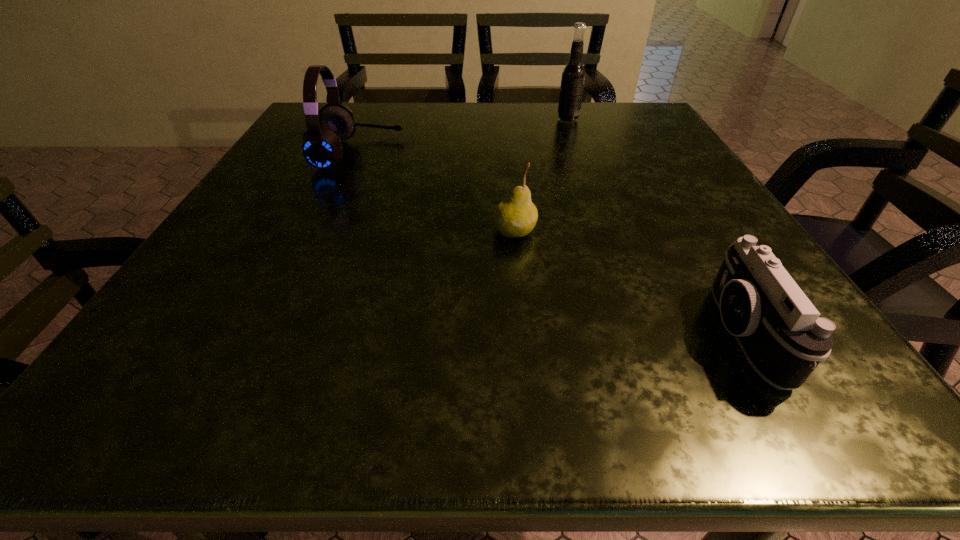
What are the coordinates of `vacant space located 0.150m on the label of the second object from right to left` in the screenshot? It's located at (494, 120).

Where is `free space located 0.120m on the ear cushions of the third shortest object`? free space located 0.120m on the ear cushions of the third shortest object is located at coordinates (456, 153).

The width and height of the screenshot is (960, 540). What are the coordinates of `free point located 0.120m on the left of the pear` in the screenshot? It's located at click(x=420, y=232).

Locate an element on the screen. This screenshot has width=960, height=540. free spot located on the front lens of the nearest object is located at coordinates (522, 334).

The width and height of the screenshot is (960, 540). Find the location of `free location located 0.360m on the front lens of the nearest object`. free location located 0.360m on the front lens of the nearest object is located at coordinates (428, 334).

The height and width of the screenshot is (540, 960). Identify the location of free space located on the front lens of the nearest object. (633, 334).

Locate an element on the screen. root beer that is at the far edge is located at coordinates (573, 76).

Locate an element on the screen. headset located at the far edge is located at coordinates (321, 143).

Image resolution: width=960 pixels, height=540 pixels. I want to click on object that is at the near edge, so click(783, 336).

In order to click on object present at the left edge in this screenshot , I will do `click(321, 143)`.